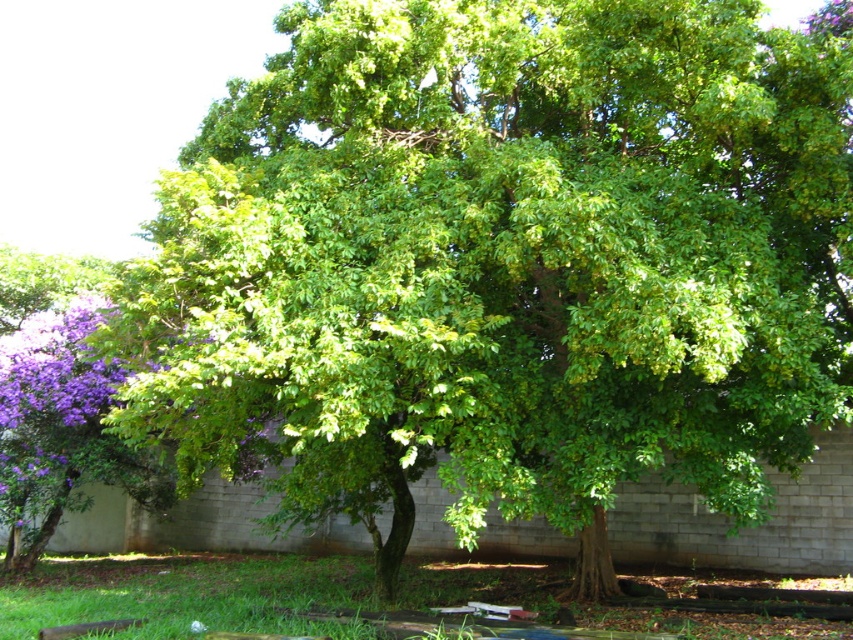
Question: Which point is closer to the camera?

Choices:
 (A) (57, 339)
 (B) (97, 573)

Answer: (A)

Question: Which point is farther from the camera taking this photo?

Choices:
 (A) (86, 333)
 (B) (180, 554)

Answer: (B)

Question: Does green grass at lower center appear under purple matte flower at left?

Choices:
 (A) yes
 (B) no

Answer: (A)

Question: Does green grass at lower center have a greater width compared to purple matte flower at left?

Choices:
 (A) no
 (B) yes

Answer: (B)

Question: Where is green grass at lower center located in relation to purple matte flower at left in the image?

Choices:
 (A) above
 (B) below

Answer: (B)